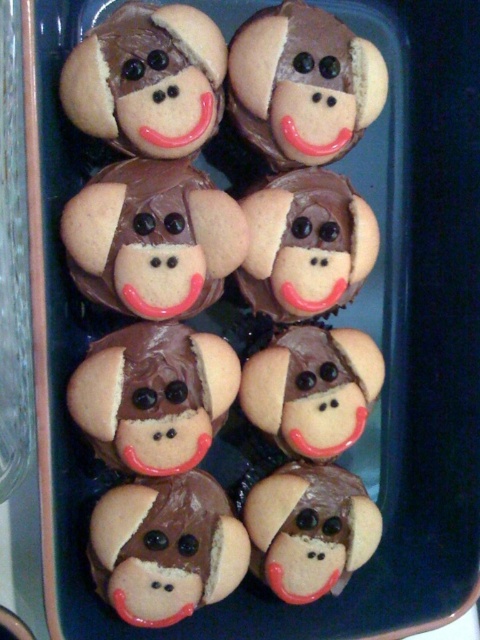
From the picture: Can you confirm if matte chocolate monkey face at center is smaller than matte brown cookie at center?

No, matte chocolate monkey face at center is not smaller than matte brown cookie at center.

Does point (290, 120) come farther from viewer compared to point (192, 300)?

That is False.

This screenshot has width=480, height=640. Identify the location of matte chocolate monkey face at center. (313, 88).

Find the location of `matte chocolate monkey face at center`. matte chocolate monkey face at center is located at coordinates (313, 88).